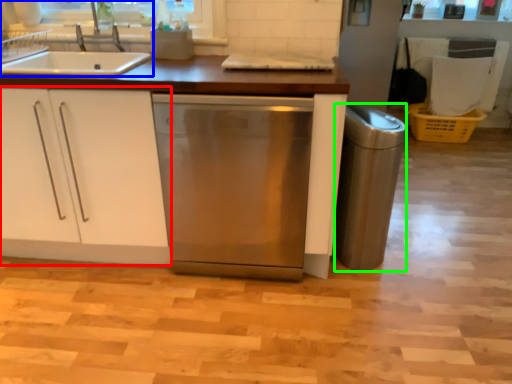
Question: Which is nearer to the cabinetry (highlighted by a red box)? kitchen appliance (highlighted by a blue box) or appliance (highlighted by a green box).

Choices:
 (A) kitchen appliance
 (B) appliance

Answer: (A)